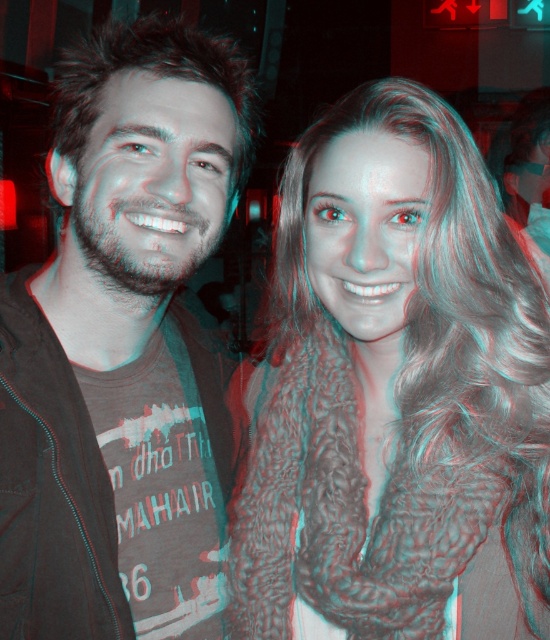
Who is more distant from viewer, (330,221) or (201,61)?

Point (201,61)

Which of these two, fuzzy brown scarf at center or dark gray t-shirt at center, stands shorter?

With less height is fuzzy brown scarf at center.

Which is behind, point (496, 452) or point (129, 342)?

Point (129, 342)

Find the location of `fuzzy brown scarf at center`. fuzzy brown scarf at center is located at coordinates (397, 392).